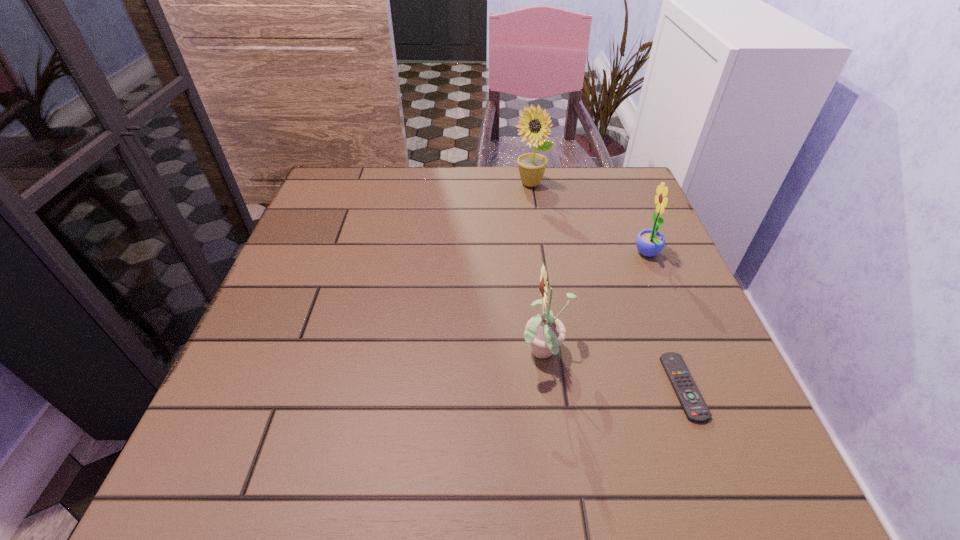
Where is `blank area at the far right corner`? blank area at the far right corner is located at coordinates (620, 201).

Where is `vacant space that's between the farthest sunflower and the remote control`? vacant space that's between the farthest sunflower and the remote control is located at coordinates (607, 286).

The image size is (960, 540). In order to click on empty space between the farthest sunflower and the shortest object in this screenshot , I will do `click(607, 286)`.

Where is `free space between the nearest sunflower and the remote control`? This screenshot has width=960, height=540. free space between the nearest sunflower and the remote control is located at coordinates (614, 370).

At what (x,y) coordinates should I click in order to perform the action: click on free space between the farthest object and the shortest object. Please return your answer as a coordinate pair (x, y). The height and width of the screenshot is (540, 960). Looking at the image, I should click on (607, 286).

The image size is (960, 540). Identify the location of vacant space that's between the remote control and the second farthest object. (665, 321).

You are a GUI agent. You are given a task and a screenshot of the screen. Output one action in this format:
    pyautogui.click(x=<x>, y=<y>)
    Task: Click on the free space that is in between the farthest object and the remote control
    The height and width of the screenshot is (540, 960).
    Given the screenshot: What is the action you would take?
    pyautogui.click(x=607, y=286)

This screenshot has width=960, height=540. I want to click on free space that is in between the nearest sunflower and the farthest sunflower, so click(x=538, y=269).

The image size is (960, 540). I want to click on free point between the shortest object and the rightmost sunflower, so click(x=665, y=321).

Find the location of a particular element. This screenshot has height=540, width=960. vacant point located between the nearest sunflower and the farthest object is located at coordinates (538, 269).